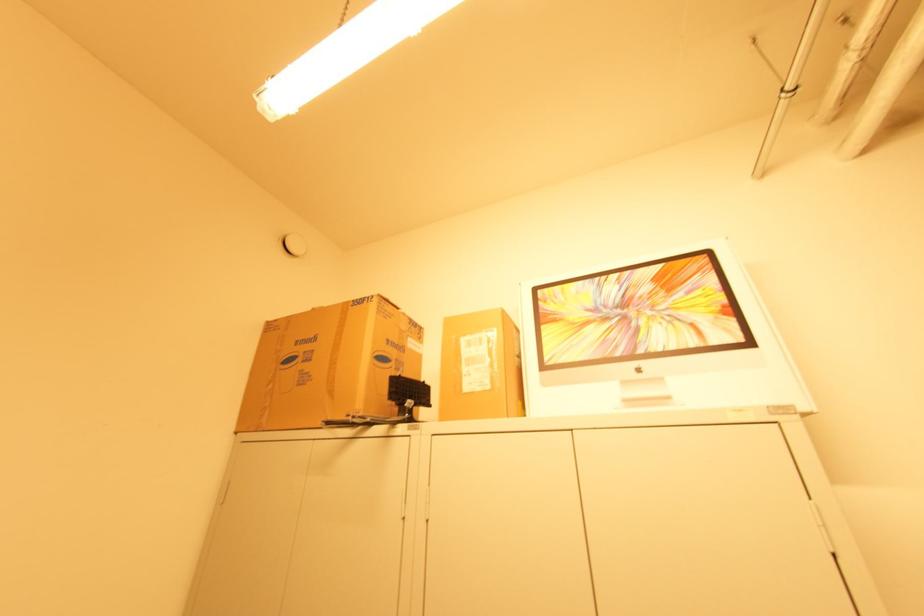
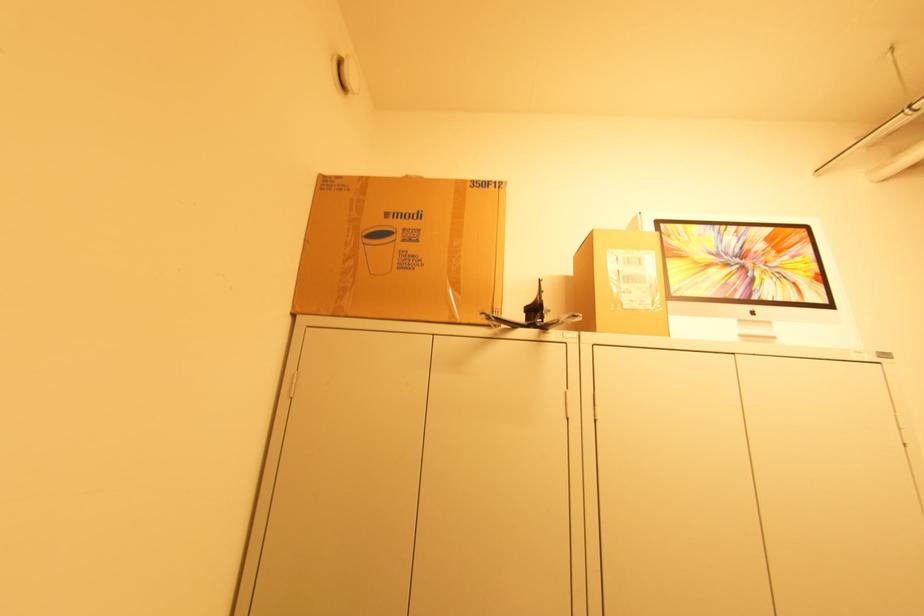
Question: The images are taken continuously from a first-person perspective. In which direction are you moving?

Choices:
 (A) Left
 (B) Right
 (C) Forward
 (D) Backward

Answer: (A)